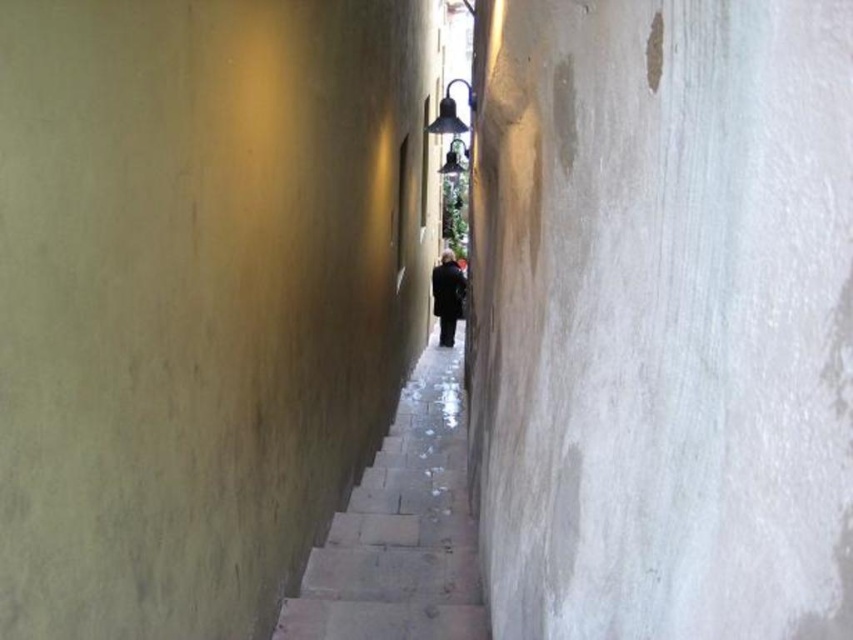
Looking at this image, you are standing at the entrance of the alleyway and see both the smooth stone steps at center and the dark wool coat at center. Which object is closer to your feet?

The smooth stone steps at center is below dark wool coat at center, so the smooth stone steps at center is closer to your feet.

You are a delivery person carrying a heavy package and need to walk through the alleyway. You see the smooth stone steps at center and the dark wool coat at center. Which object should you avoid stepping on to keep your footing stable?

You should avoid stepping on the dark wool coat at center because the smooth stone steps at center are meant for walking, while the coat is likely an obstacle on the ground.